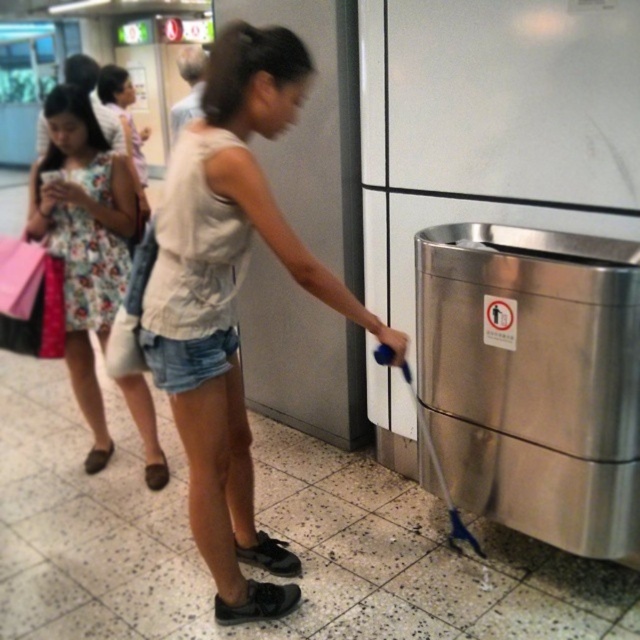
Question: Is the position of white cotton tank top at center less distant than that of floral fabric dress at left?

Choices:
 (A) yes
 (B) no

Answer: (A)

Question: Can you confirm if white cotton tank top at center is wider than floral fabric dress at left?

Choices:
 (A) yes
 (B) no

Answer: (A)

Question: Which point is closer to the camera?

Choices:
 (A) (168, 292)
 (B) (76, 164)

Answer: (A)

Question: Which point is farther from the camera taking this photo?

Choices:
 (A) (371, 328)
 (B) (44, 192)

Answer: (B)

Question: Can you confirm if white cotton tank top at center is positioned above floral fabric dress at left?

Choices:
 (A) yes
 (B) no

Answer: (B)